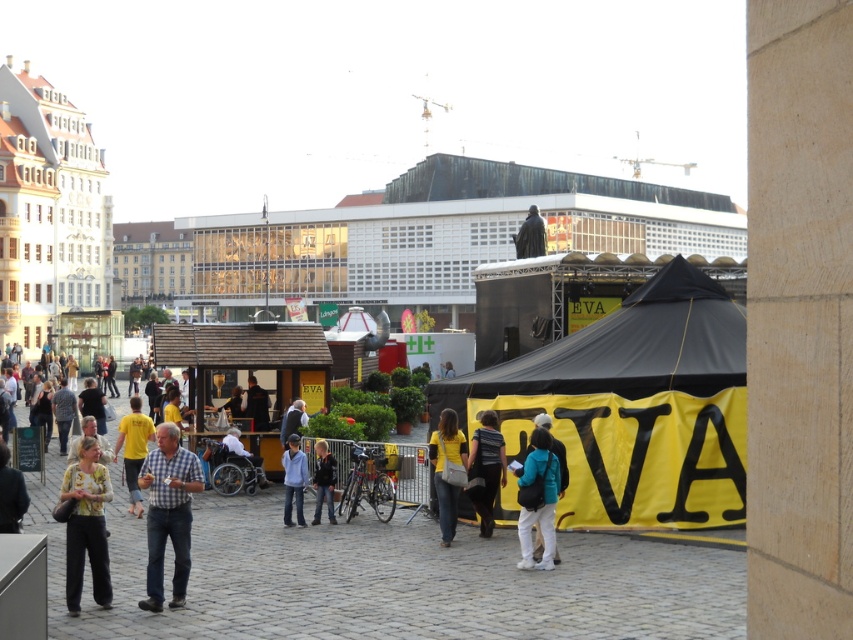
Question: From the image, what is the correct spatial relationship of black/yellow fabric tent at center in relation to yellow shirt at lower left?

Choices:
 (A) below
 (B) above

Answer: (B)

Question: Among these points, which one is farthest from the camera?

Choices:
 (A) (296, 509)
 (B) (433, 432)
 (C) (15, 531)
 (D) (540, 224)

Answer: (D)

Question: Is printed fabric blouse at lower left to the left of yellow t-shirt at center from the viewer's perspective?

Choices:
 (A) yes
 (B) no

Answer: (B)

Question: Which point appears closest to the camera in this image?

Choices:
 (A) (335, 480)
 (B) (482, 412)
 (C) (558, 481)
 (D) (523, 221)

Answer: (C)

Question: Which point is farther to the camera?

Choices:
 (A) black/yellow fabric tent at center
 (B) printed fabric blouse at lower left
 (C) teal fabric backpack at center

Answer: (A)

Question: Can you confirm if black/yellow fabric tent at center is positioned to the left of yellow t-shirt at center?

Choices:
 (A) yes
 (B) no

Answer: (B)